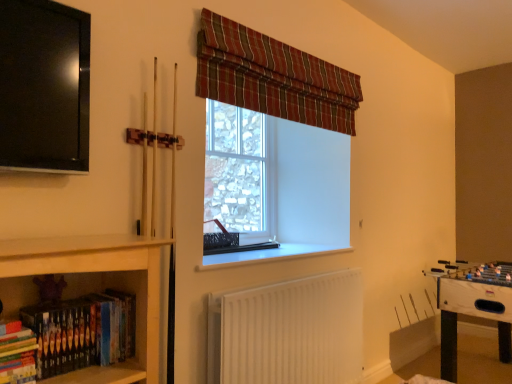
Question: Would you say plaid fabric curtain at upper center is to the left or to the right of clear glass window at center in the picture?

Choices:
 (A) right
 (B) left

Answer: (A)

Question: From the image's perspective, is plaid fabric curtain at upper center located above or below clear glass window at center?

Choices:
 (A) above
 (B) below

Answer: (A)

Question: Based on their relative distances, which object is farther from the plaid fabric curtain at upper center?

Choices:
 (A) hardcover books at lower left, acting as the 2th book starting from the right
 (B) white plastic window sill at center
 (C) white glossy foosball table at lower right
 (D) white ribbed radiator at lower center
 (E) clear glass window at center

Answer: (A)

Question: Which object is positioned farthest from the plaid fabric curtain at upper center?

Choices:
 (A) clear glass window at center
 (B) white ribbed radiator at lower center
 (C) hardcover books at lower left, acting as the 2th book starting from the right
 (D) white plastic window sill at center
 (E) hardcover books at lower left, which appears as the second book when viewed from the left

Answer: (C)